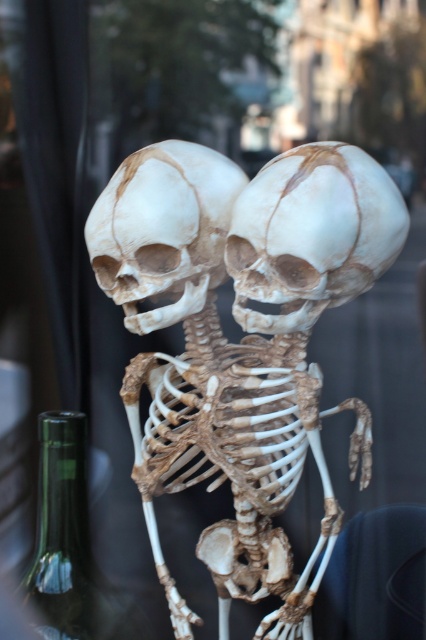
Question: Among these objects, which one is farthest from the camera?

Choices:
 (A) brown textured skeleton at center
 (B) white matte skull at center
 (C) green glass bottle at lower left

Answer: (C)

Question: Which point is farther to the camera?

Choices:
 (A) white matte skull at center
 (B) green glass bottle at lower left

Answer: (B)

Question: Is brown textured skeleton at center positioned before green glass bottle at lower left?

Choices:
 (A) yes
 (B) no

Answer: (A)

Question: Does smooth beige skull at center have a greater width compared to green glass bottle at lower left?

Choices:
 (A) no
 (B) yes

Answer: (B)

Question: Does brown textured skeleton at center lie behind green glass bottle at lower left?

Choices:
 (A) yes
 (B) no

Answer: (B)

Question: Which point is closer to the camera?

Choices:
 (A) white matte skull at center
 (B) smooth beige skull at center
 (C) brown textured skeleton at center
 (D) green glass bottle at lower left

Answer: (A)